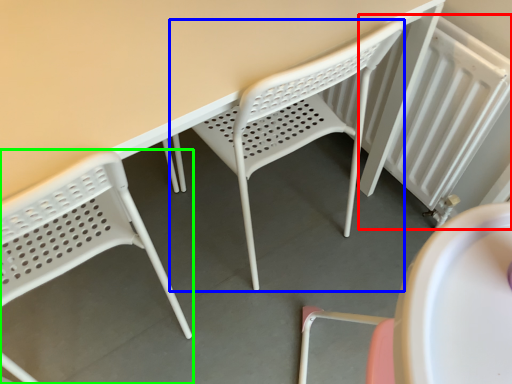
Question: Considering the real-world distances, which object is farthest from radiator (highlighted by a red box)? chair (highlighted by a blue box) or chair (highlighted by a green box)?

Choices:
 (A) chair
 (B) chair

Answer: (B)